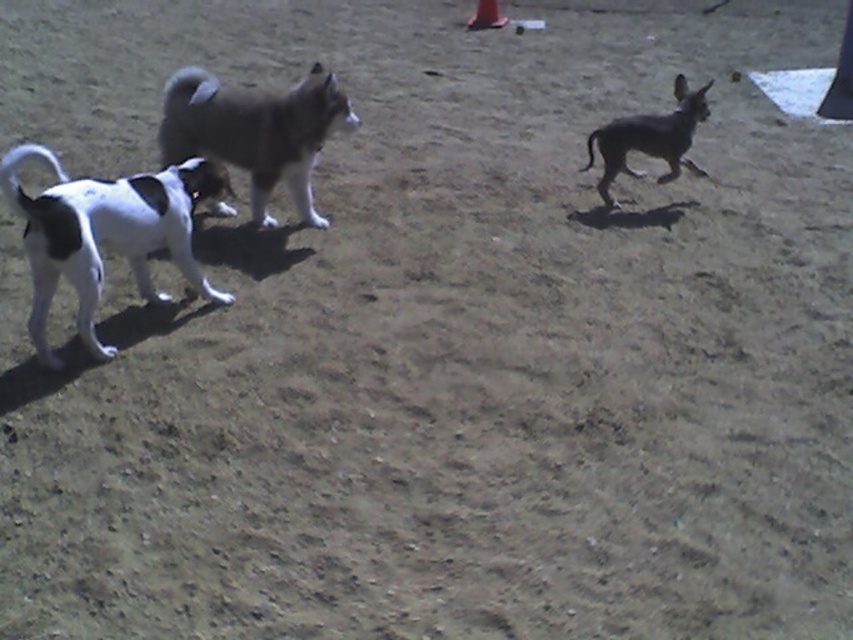
You are a photographer setting up equipment in the park. You have a gray fur dog at center and an orange matte cone at upper right in your shot. Which object is wider in your current frame?

The gray fur dog at center is wider than the orange matte cone at upper right.

You are a dog owner who wants to ensure your dog stays within a safe distance from an orange matte cone at upper right. Your dog is currently at the smooth brown dog at right. What is the minimum distance you need to keep your dog away from the cone to ensure safety?

The smooth brown dog at right is 1.96 meters away from the orange matte cone at upper right, so to ensure safety, you should keep your dog at least 1.96 meters away from the cone.

You are a photographer trying to capture a group photo of the white and black fur dog at left and the smooth brown dog at right. To ensure both dogs are in frame, should you position yourself to the left or right of the dogs?

You should position yourself to the right of the dogs to ensure both the white and black fur dog at left and the smooth brown dog at right are in frame, as the white and black fur dog at left is to the left of the smooth brown dog at right.